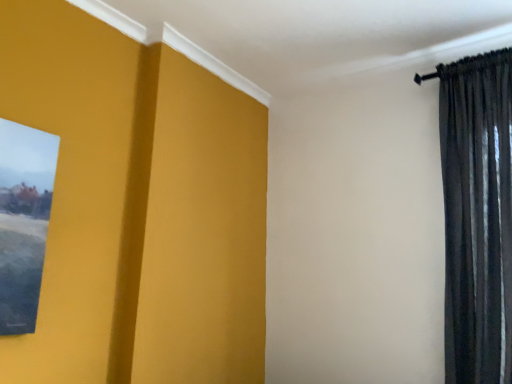
The width and height of the screenshot is (512, 384). I want to click on black velvet curtain at right, so click(477, 216).

What do you see at coordinates (477, 216) in the screenshot? Image resolution: width=512 pixels, height=384 pixels. I see `black velvet curtain at right` at bounding box center [477, 216].

Locate an element on the screen. The height and width of the screenshot is (384, 512). black velvet curtain at right is located at coordinates [x=477, y=216].